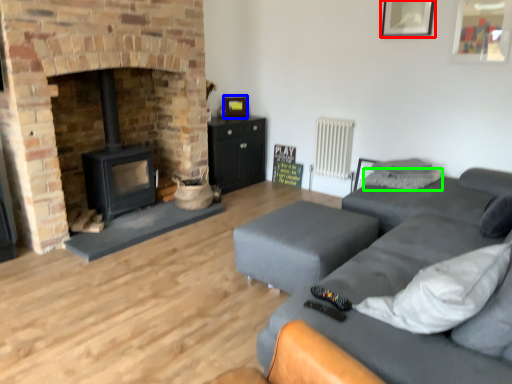
Question: Estimate the real-world distances between objects in this image. Which object is closer to picture frame (highlighted by a red box), picture frame (highlighted by a blue box) or pillow (highlighted by a green box)?

Choices:
 (A) picture frame
 (B) pillow

Answer: (B)